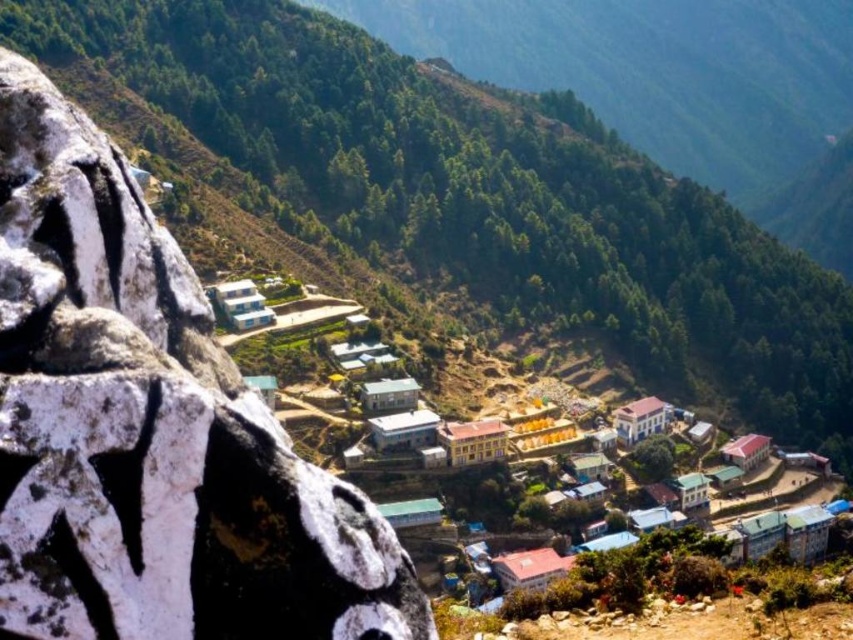
Question: Is green forested hillside at upper center wider than white matte building at center?

Choices:
 (A) yes
 (B) no

Answer: (A)

Question: Which of these objects is positioned farthest from the white textured rock at left?

Choices:
 (A) green matte rock at left
 (B) white matte building at center
 (C) green forested hillside at upper center

Answer: (C)

Question: Where is white textured rock at left located in relation to green forested hillside at upper center in the image?

Choices:
 (A) above
 (B) below

Answer: (B)

Question: Can you confirm if green matte rock at left is smaller than green forested hillside at upper center?

Choices:
 (A) yes
 (B) no

Answer: (A)

Question: Among these objects, which one is farthest from the camera?

Choices:
 (A) white matte building at center
 (B) green forested hillside at upper center

Answer: (B)

Question: Which point is closer to the camera?

Choices:
 (A) (474, 493)
 (B) (669, 195)
 (C) (184, 323)

Answer: (C)